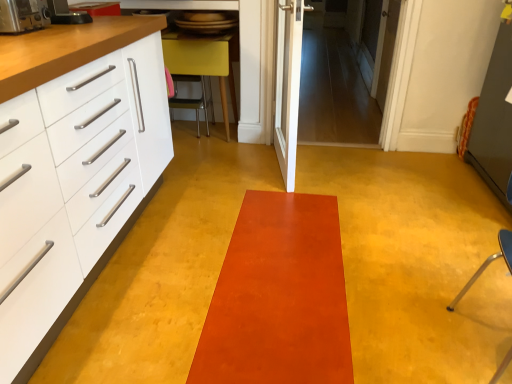
The width and height of the screenshot is (512, 384). What are the coordinates of `free space between blue plastic chair at right, marked as the second furniture in a top-to-bottom arrangement, and metallic silver chair at center` in the screenshot? It's located at (309, 220).